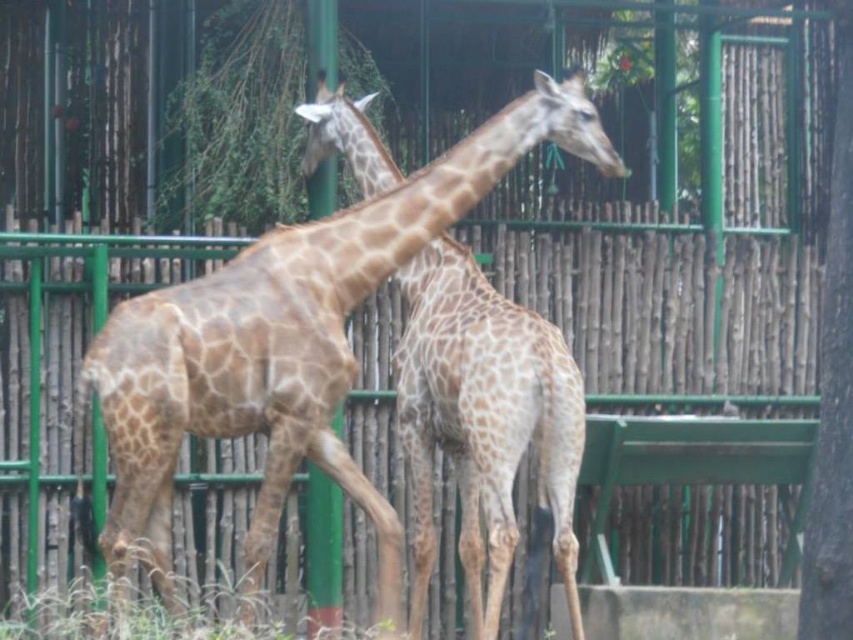
You are standing at the entrance of the zoo enclosure and see the green bamboo fence at center. Can you determine if the fence is positioned closer to the front or the back of the enclosure based on its coordinates?

The green bamboo fence at center is located at point (675, 384), which places it closer to the back of the enclosure since the coordinates suggest it is positioned near the upper right quadrant of the image.

You are a zookeeper trying to ensure the safety of the spotted fur giraffe at center. You notice the green bamboo fence at center. Do you think the fence is tall enough to prevent the giraffe from reaching over it?

The green bamboo fence at center is not as tall as the spotted fur giraffe at center, so the fence is not tall enough to prevent the giraffe from reaching over it.

You are a zookeeper trying to separate the two giraffes using a movable divider. The divider can only be placed between the green bamboo fence at center and the spotted fur giraffe at center. Based on their positions, where should you position the divider?

The divider should be placed to the right of the spotted fur giraffe at center since the green bamboo fence at center is already positioned to the right of it, creating a natural separation point.